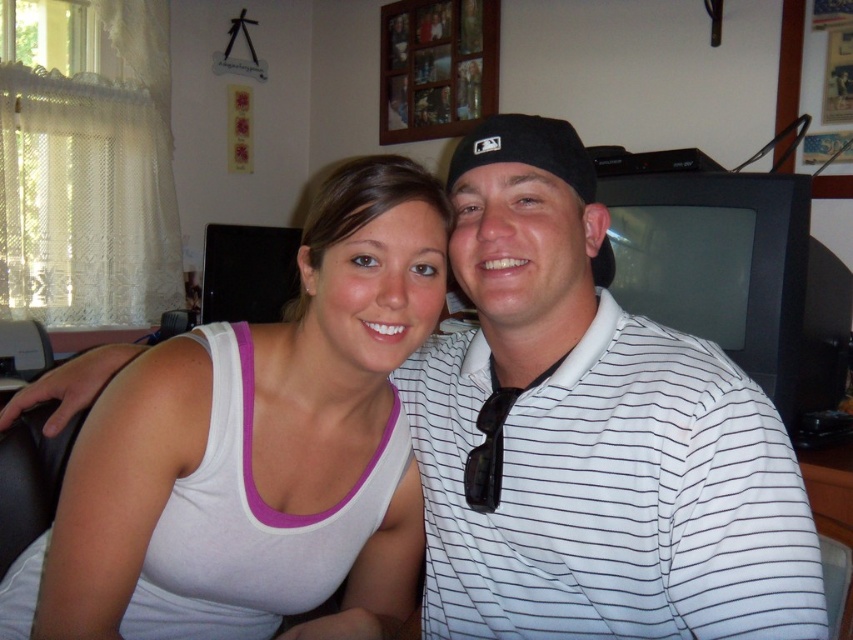
You are a photographer setting up a shoot in this living room. You need to position a light source so that it illuminates both the white striped polo shirt at right and the white tank top at center without casting harsh shadows. Considering their heights, which object should be placed closer to the light source?

The white striped polo shirt at right has a lesser height compared to the white tank top at center, so the light source should be placed closer to the white striped polo shirt at right to ensure even illumination and avoid harsh shadows.

You are standing in the living room and need to find the white striped polo shirt at right. According to the scene description, where exactly is it positioned?

The white striped polo shirt at right is located at point (612, 496).